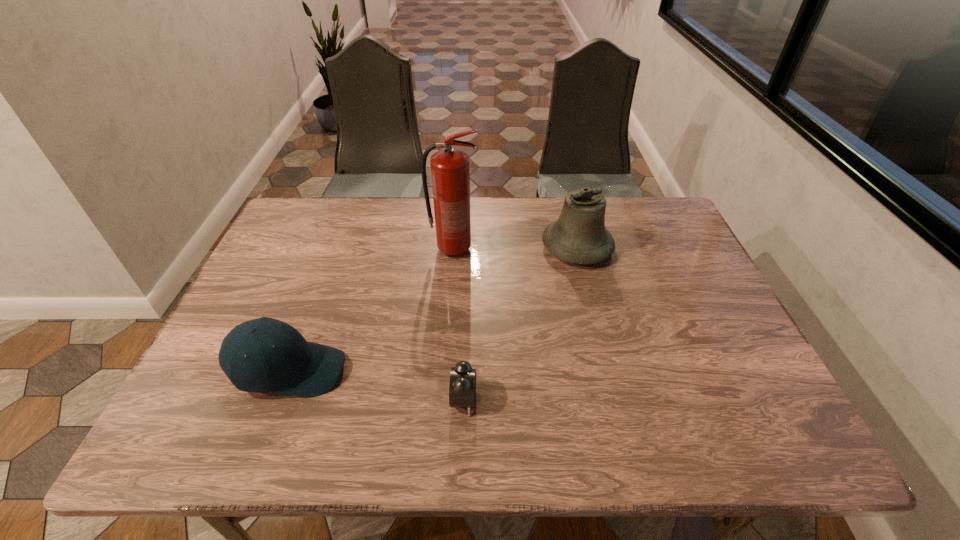
Where is `fire extinguisher present at the far edge`? This screenshot has height=540, width=960. fire extinguisher present at the far edge is located at coordinates (450, 169).

Where is `bell positioned at the far edge`? bell positioned at the far edge is located at coordinates (579, 236).

Locate an element on the screen. The width and height of the screenshot is (960, 540). object at the near edge is located at coordinates (462, 389).

Where is `object that is positioned at the left edge`? Image resolution: width=960 pixels, height=540 pixels. object that is positioned at the left edge is located at coordinates (293, 366).

The width and height of the screenshot is (960, 540). I want to click on vacant space at the far edge, so click(488, 206).

Identify the location of vacant region at the near edge of the desktop. (538, 428).

I want to click on vacant area at the left edge, so click(x=318, y=248).

Where is `blank area at the right edge`? The width and height of the screenshot is (960, 540). blank area at the right edge is located at coordinates (683, 285).

Locate an element on the screen. vacant space at the far left corner of the desktop is located at coordinates (319, 220).

This screenshot has width=960, height=540. I want to click on free spot between the shortest object and the second shortest object, so click(377, 385).